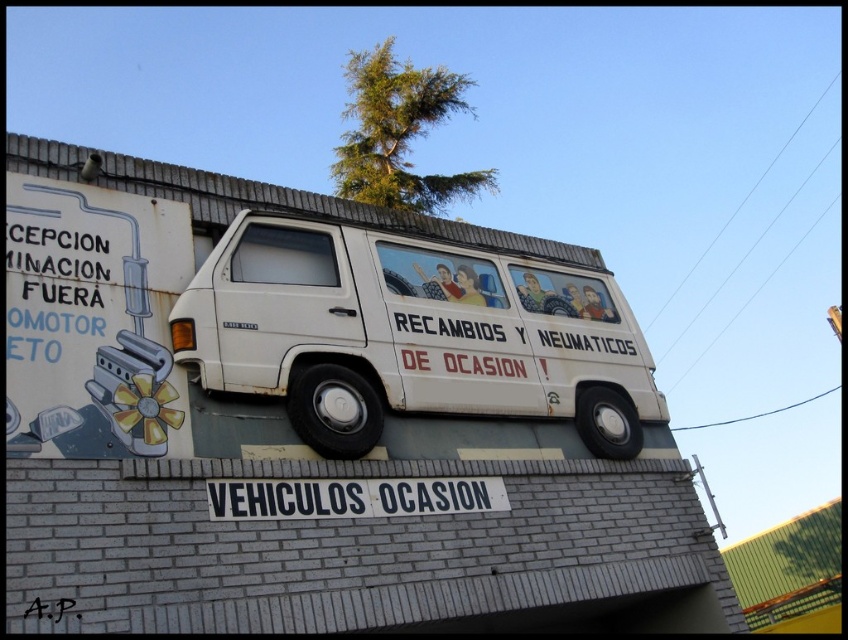
The image size is (848, 640). Describe the element at coordinates (410, 333) in the screenshot. I see `white matte van at center` at that location.

Image resolution: width=848 pixels, height=640 pixels. I want to click on white matte van at center, so click(410, 333).